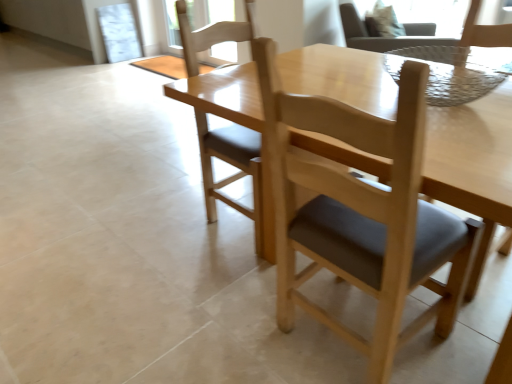
Find the location of a particular element. light brown wood chair at upper right, the 2th chair positioned from the right is located at coordinates (379, 37).

At what (x,y) coordinates should I click in order to perform the action: click on light brown wood chair at upper right, acting as the first chair starting from the top. Please return your answer as a coordinate pair (x, y). This screenshot has height=384, width=512. Looking at the image, I should click on (484, 31).

Locate an element on the screen. The width and height of the screenshot is (512, 384). light brown wood chair at center, which is the 3th chair from back to front is located at coordinates (237, 176).

Is point (260, 215) closer or farther from the camera than point (347, 222)?

Point (260, 215) is positioned farther from the camera compared to point (347, 222).

Who is bigger, light brown wood chair at center, which is counted as the 1th chair, starting from the left, or light brown wood chair at center, which is the third chair in right-to-left order?

With larger size is light brown wood chair at center, which is the third chair in right-to-left order.

Considering the relative positions of light brown wood chair at center, which is the 3th chair from back to front, and light brown wood chair at center, which is the 1th chair in bottom-to-top order, in the image provided, is light brown wood chair at center, which is the 3th chair from back to front, in front of light brown wood chair at center, which is the 1th chair in bottom-to-top order,?

No, it is not.

Can you tell me how much light brown wood chair at center, which is the 3th chair from back to front, and light brown wood chair at center, which is the third chair in right-to-left order, differ in facing direction?

There is a 88.9-degree angle between the facing directions of light brown wood chair at center, which is the 3th chair from back to front, and light brown wood chair at center, which is the third chair in right-to-left order.

Which point is more distant from viewer, (x=446, y=295) or (x=181, y=100)?

Positioned behind is point (x=181, y=100).

Does light brown wood chair at center, which is the 1th chair in bottom-to-top order, lie behind light brown wood chair at center, the 2th chair in the bottom-to-top sequence?

No, light brown wood chair at center, which is the 1th chair in bottom-to-top order, is closer to the camera.

From the picture: Between light brown wood chair at center, placed as the 2th chair when sorted from left to right, and light brown wood chair at center, the 2th chair in the bottom-to-top sequence, which one has less height?

With less height is light brown wood chair at center, the 2th chair in the bottom-to-top sequence.

Is light brown wood chair at center, the fourth chair from the back, far away from light brown wood chair at center, which is counted as the 1th chair, starting from the left?

They are positioned close to each other.

Would you say light brown wood chair at center, which is counted as the 3th chair, starting from the top, is inside or outside light brown wood chair at upper right, the 2th chair positioned from the right?

light brown wood chair at center, which is counted as the 3th chair, starting from the top, is not inside light brown wood chair at upper right, the 2th chair positioned from the right, it's outside.

Locate an element on the screen. the 2nd chair to the right of the light brown wood chair at center, which is the 3th chair from back to front, starting your count from the anchor is located at coordinates (379, 37).

In the scene shown: Considering the positions of objects light brown wood chair at center, which ranks as the second chair in front-to-back order, and light brown wood chair at upper right, the 2th chair positioned from the back, in the image provided, who is more to the left, light brown wood chair at center, which ranks as the second chair in front-to-back order, or light brown wood chair at upper right, the 2th chair positioned from the back,?

light brown wood chair at center, which ranks as the second chair in front-to-back order.

How much distance is there between light brown wood chair at center, which ranks as the fourth chair in right-to-left order, and light brown wood chair at upper right, marked as the 3th chair in a front-to-back arrangement?

light brown wood chair at center, which ranks as the fourth chair in right-to-left order, and light brown wood chair at upper right, marked as the 3th chair in a front-to-back arrangement, are 4.91 feet apart from each other.

Considering the sizes of light brown wood chair at upper right, which is the 4th chair from bottom to top, and light brown wood chair at center, placed as the 2th chair when sorted from left to right, in the image, is light brown wood chair at upper right, which is the 4th chair from bottom to top, wider or thinner than light brown wood chair at center, placed as the 2th chair when sorted from left to right,?

Considering their sizes, light brown wood chair at upper right, which is the 4th chair from bottom to top, looks broader than light brown wood chair at center, placed as the 2th chair when sorted from left to right.

Relative to light brown wood chair at center, placed as the first chair when sorted from front to back, is light brown wood chair at upper right, arranged as the first chair when viewed from the back, in front or behind?

light brown wood chair at upper right, arranged as the first chair when viewed from the back, is behind light brown wood chair at center, placed as the first chair when sorted from front to back.

From the image's perspective, is light brown wood chair at upper right, arranged as the first chair when viewed from the back, on light brown wood chair at center, which is the third chair in right-to-left order?

Correct, light brown wood chair at upper right, arranged as the first chair when viewed from the back, appears higher than light brown wood chair at center, which is the third chair in right-to-left order, in the image.

From a real-world perspective, between light brown wood chair at upper right, acting as the first chair starting from the top, and light brown wood chair at center, placed as the fourth chair when sorted from top to bottom, who is vertically higher?

light brown wood chair at center, placed as the fourth chair when sorted from top to bottom, is physically above.

Is point (265, 118) farther from camera compared to point (466, 38)?

No.

Starting from the light brown wood chair at upper right, which is the 4th chair from bottom to top, which chair is the 3rd one in front? Please provide its 2D coordinates.

[(362, 213)]

Is light brown wood chair at center, the fourth chair from the back, not near light brown wood chair at upper right, acting as the first chair starting from the top?

No, there isn't a large distance between light brown wood chair at center, the fourth chair from the back, and light brown wood chair at upper right, acting as the first chair starting from the top.

Is light brown wood chair at center, the fourth chair from the back, taller or shorter than light brown wood chair at upper right, acting as the first chair starting from the top?

Considering their sizes, light brown wood chair at center, the fourth chair from the back, has more height than light brown wood chair at upper right, acting as the first chair starting from the top.

In the scene shown: Is light brown wood chair at center, which is counted as the 1th chair, starting from the left, at the back of light brown wood chair at upper right, the 3th chair when ordered from bottom to top?

light brown wood chair at upper right, the 3th chair when ordered from bottom to top, is not turned away from light brown wood chair at center, which is counted as the 1th chair, starting from the left.

You are a GUI agent. You are given a task and a screenshot of the screen. Output one action in this format:
    pyautogui.click(x=<x>, y=<y>)
    Task: Click on the chair that is the 2nd one above the light brown wood chair at center, which is counted as the 3th chair, starting from the top (from a real-world perspective)
    The image size is (512, 384).
    Given the screenshot: What is the action you would take?
    pyautogui.click(x=379, y=37)

From the image's perspective, who appears lower, light brown wood chair at upper right, the 2th chair positioned from the right, or light brown wood chair at center, which ranks as the fourth chair in right-to-left order?

light brown wood chair at center, which ranks as the fourth chair in right-to-left order, is shown below in the image.

Measure the distance between light brown wood chair at upper right, acting as the first chair starting from the top, and light brown wood chair at center, which ranks as the fourth chair in right-to-left order.

light brown wood chair at upper right, acting as the first chair starting from the top, is 1.01 meters from light brown wood chair at center, which ranks as the fourth chair in right-to-left order.

Is light brown wood chair at upper right, arranged as the first chair when viewed from the back, oriented away from light brown wood chair at center, which is counted as the 3th chair, starting from the top?

That's not correct — light brown wood chair at upper right, arranged as the first chair when viewed from the back, is not looking away from light brown wood chair at center, which is counted as the 3th chair, starting from the top.

In the scene shown: Does light brown wood chair at upper right, arranged as the first chair when viewed from the back, appear on the left side of light brown wood chair at center, the 2th chair in the bottom-to-top sequence?

No, light brown wood chair at upper right, arranged as the first chair when viewed from the back, is not to the left of light brown wood chair at center, the 2th chair in the bottom-to-top sequence.

Which is behind, point (477, 37) or point (208, 204)?

The point (208, 204) is behind.

Identify the location of chair on the left of light brown wood chair at center, placed as the fourth chair when sorted from top to bottom. The image size is (512, 384). (237, 176).

Where is `chair below the light brown wood chair at center, which ranks as the second chair in front-to-back order (from the image's perspective)`? chair below the light brown wood chair at center, which ranks as the second chair in front-to-back order (from the image's perspective) is located at coordinates (362, 213).

Looking at the image, which one is located closer to light brown wood chair at upper right, acting as the first chair starting from the top, light brown wood chair at center, which is counted as the 3th chair, starting from the top, or light brown wood chair at upper right, the 2th chair positioned from the back?

light brown wood chair at center, which is counted as the 3th chair, starting from the top.

Looking at the image, which one is located further to light brown wood chair at upper right, the 2th chair positioned from the back, light brown wood chair at upper right, acting as the first chair starting from the top, or light brown wood chair at center, which is the 1th chair in bottom-to-top order?

The object further to light brown wood chair at upper right, the 2th chair positioned from the back, is light brown wood chair at center, which is the 1th chair in bottom-to-top order.

Considering their positions, is light brown wood chair at center, the 2th chair in the bottom-to-top sequence, positioned closer to light brown wood chair at upper right, which is the 4th chair from bottom to top, than light brown wood chair at center, the fourth chair from the back?

Among the two, light brown wood chair at center, the fourth chair from the back, is located nearer to light brown wood chair at upper right, which is the 4th chair from bottom to top.

Looking at the image, which one is located closer to light brown wood chair at center, which is the third chair in right-to-left order, light brown wood chair at upper right, placed as the 4th chair when sorted from front to back, or light brown wood chair at center, which is counted as the 1th chair, starting from the left?

light brown wood chair at center, which is counted as the 1th chair, starting from the left, is closer to light brown wood chair at center, which is the third chair in right-to-left order.

When comparing their distances from light brown wood chair at upper right, which appears as the 4th chair when viewed from the left, does light brown wood chair at upper right, marked as the 3th chair in a front-to-back arrangement, or light brown wood chair at center, which is the third chair in right-to-left order, seem further?

Based on the image, light brown wood chair at upper right, marked as the 3th chair in a front-to-back arrangement, appears to be further to light brown wood chair at upper right, which appears as the 4th chair when viewed from the left.

Based on the photo, based on their spatial positions, is light brown wood chair at upper right, which is the 4th chair from bottom to top, or light brown wood chair at upper right, the 3th chair when ordered from left to right, further from light brown wood chair at center, which is counted as the 3th chair, starting from the top?

light brown wood chair at upper right, the 3th chair when ordered from left to right, is positioned further to the anchor light brown wood chair at center, which is counted as the 3th chair, starting from the top.

From the image, which object appears to be farther from light brown wood chair at center, which is counted as the 1th chair, starting from the left, light brown wood chair at upper right, the 3th chair when ordered from left to right, or light brown wood chair at upper right, placed as the 4th chair when sorted from front to back?

light brown wood chair at upper right, the 3th chair when ordered from left to right, is positioned further to the anchor light brown wood chair at center, which is counted as the 1th chair, starting from the left.

Looking at the image, which one is located further to light brown wood chair at center, the fourth chair from the back, light brown wood chair at upper right, acting as the first chair starting from the top, or light brown wood chair at upper right, the 2th chair positioned from the right?

The object further to light brown wood chair at center, the fourth chair from the back, is light brown wood chair at upper right, the 2th chair positioned from the right.

Where is `chair located between light brown wood chair at center, placed as the 2th chair when sorted from left to right, and light brown wood chair at upper right, the 3th chair when ordered from left to right, in the depth direction`? This screenshot has width=512, height=384. chair located between light brown wood chair at center, placed as the 2th chair when sorted from left to right, and light brown wood chair at upper right, the 3th chair when ordered from left to right, in the depth direction is located at coordinates (237, 176).

Locate an element on the screen. chair between light brown wood chair at center, the 2th chair in the bottom-to-top sequence, and light brown wood chair at upper right, which appears as the 4th chair when viewed from the left, along the z-axis is located at coordinates (379, 37).